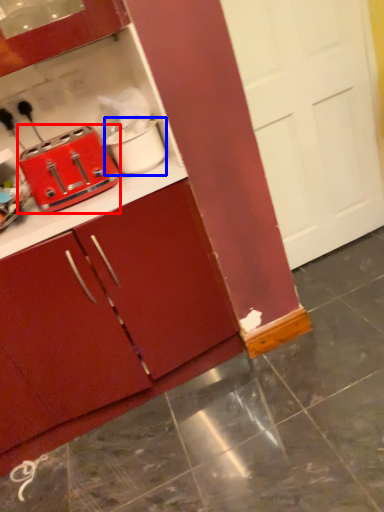
Question: Which of the following is the closest to the observer, toaster (highlighted by a red box) or appliance (highlighted by a blue box)?

Choices:
 (A) toaster
 (B) appliance

Answer: (A)